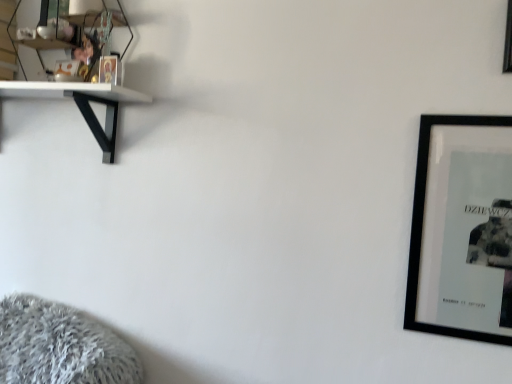
What is the approximate width of clear glass shelf at upper left?

It is 4.11 inches.

The image size is (512, 384). I want to click on clear glass shelf at upper left, so click(77, 31).

Considering the points (447, 205) and (503, 71), which point is behind, point (447, 205) or point (503, 71)?

The point (447, 205) is behind.

I want to click on picture frame located below the black matte picture frame at upper right, acting as the second picture frame starting from the bottom (from the image's perspective), so click(462, 229).

Is black matte picture frame at right, the second picture frame viewed from the top, positioned with its back to black matte picture frame at upper right, which is the 1th picture frame in top-to-bottom order?

No.

Is black matte picture frame at upper right, which is the 1th picture frame in top-to-bottom order, surrounding black matte picture frame at right, positioned as the first picture frame in bottom-to-top order?

No.

Is black matte picture frame at upper right, acting as the second picture frame starting from the bottom, not close to black matte picture frame at right, the second picture frame viewed from the top?

No, there isn't a large distance between black matte picture frame at upper right, acting as the second picture frame starting from the bottom, and black matte picture frame at right, the second picture frame viewed from the top.

From a real-world perspective, is black matte picture frame at upper right, acting as the second picture frame starting from the bottom, physically below black matte picture frame at right, the second picture frame viewed from the top?

No, from a real-world perspective, black matte picture frame at upper right, acting as the second picture frame starting from the bottom, is not beneath black matte picture frame at right, the second picture frame viewed from the top.

Looking at this image, can you confirm if black matte picture frame at right, the second picture frame viewed from the top, is smaller than clear glass shelf at upper left?

Yes.

Which is closer, [463,147] or [26,30]?

The point [463,147] is more forward.

Between black matte picture frame at right, the second picture frame viewed from the top, and clear glass shelf at upper left, which one has more height?

With more height is black matte picture frame at right, the second picture frame viewed from the top.

Locate an element on the screen. This screenshot has height=384, width=512. shelf behind the black matte picture frame at right, the second picture frame viewed from the top is located at coordinates (77, 31).

From a real-world perspective, between clear glass shelf at upper left and black matte picture frame at upper right, which is the 1th picture frame in top-to-bottom order, who is vertically higher?

In real-world perspective, clear glass shelf at upper left is above.

From the image's perspective, would you say clear glass shelf at upper left is shown under black matte picture frame at upper right, acting as the second picture frame starting from the bottom?

No, from the image's perspective, clear glass shelf at upper left is not below black matte picture frame at upper right, acting as the second picture frame starting from the bottom.

Looking at this image, is clear glass shelf at upper left not close to black matte picture frame at upper right, acting as the second picture frame starting from the bottom?

That's right, there is a large distance between clear glass shelf at upper left and black matte picture frame at upper right, acting as the second picture frame starting from the bottom.

Considering the points (62, 17) and (509, 21), which point is behind, point (62, 17) or point (509, 21)?

Point (62, 17)

Is black matte picture frame at upper right, which is the 1th picture frame in top-to-bottom order, further to the viewer compared to clear glass shelf at upper left?

That is False.

At what (x,y) coordinates should I click in order to perform the action: click on shelf lying behind the black matte picture frame at upper right, which is the 1th picture frame in top-to-bottom order. Please return your answer as a coordinate pair (x, y). Image resolution: width=512 pixels, height=384 pixels. Looking at the image, I should click on (x=77, y=31).

Is black matte picture frame at upper right, which is the 1th picture frame in top-to-bottom order, bigger than clear glass shelf at upper left?

Incorrect, black matte picture frame at upper right, which is the 1th picture frame in top-to-bottom order, is not larger than clear glass shelf at upper left.

Between black matte picture frame at upper right, acting as the second picture frame starting from the bottom, and clear glass shelf at upper left, which one appears on the left side from the viewer's perspective?

clear glass shelf at upper left is more to the left.

Considering the relative positions of clear glass shelf at upper left and black matte picture frame at right, the second picture frame viewed from the top, in the image provided, is clear glass shelf at upper left to the right of black matte picture frame at right, the second picture frame viewed from the top, from the viewer's perspective?

In fact, clear glass shelf at upper left is to the left of black matte picture frame at right, the second picture frame viewed from the top.

Is clear glass shelf at upper left inside or outside of black matte picture frame at right, positioned as the first picture frame in bottom-to-top order?

clear glass shelf at upper left is not enclosed by black matte picture frame at right, positioned as the first picture frame in bottom-to-top order.

From a real-world perspective, is clear glass shelf at upper left physically above black matte picture frame at right, the second picture frame viewed from the top?

Correct, in the physical world, clear glass shelf at upper left is higher than black matte picture frame at right, the second picture frame viewed from the top.

Is clear glass shelf at upper left positioned in front of black matte picture frame at right, positioned as the first picture frame in bottom-to-top order?

No, it is not.

Identify the location of picture frame that is above the black matte picture frame at right, the second picture frame viewed from the top (from the image's perspective). (508, 41).

The image size is (512, 384). There is a black matte picture frame at right, positioned as the first picture frame in bottom-to-top order. Find the location of `picture frame above it (from a real-world perspective)`. picture frame above it (from a real-world perspective) is located at coordinates (508, 41).

Which object lies further to the anchor point black matte picture frame at right, positioned as the first picture frame in bottom-to-top order, clear glass shelf at upper left or black matte picture frame at upper right, which is the 1th picture frame in top-to-bottom order?

Among the two, clear glass shelf at upper left is located further to black matte picture frame at right, positioned as the first picture frame in bottom-to-top order.

Estimate the real-world distances between objects in this image. Which object is further from clear glass shelf at upper left, black matte picture frame at upper right, which is the 1th picture frame in top-to-bottom order, or black matte picture frame at right, the second picture frame viewed from the top?

black matte picture frame at upper right, which is the 1th picture frame in top-to-bottom order, is further to clear glass shelf at upper left.

From the picture: Estimate the real-world distances between objects in this image. Which object is closer to clear glass shelf at upper left, black matte picture frame at right, positioned as the first picture frame in bottom-to-top order, or black matte picture frame at upper right, acting as the second picture frame starting from the bottom?

black matte picture frame at right, positioned as the first picture frame in bottom-to-top order, lies closer to clear glass shelf at upper left than the other object.

Considering their positions, is clear glass shelf at upper left positioned closer to black matte picture frame at upper right, acting as the second picture frame starting from the bottom, than black matte picture frame at right, the second picture frame viewed from the top?

Based on the image, black matte picture frame at right, the second picture frame viewed from the top, appears to be nearer to black matte picture frame at upper right, acting as the second picture frame starting from the bottom.

When comparing their distances from black matte picture frame at right, positioned as the first picture frame in bottom-to-top order, does black matte picture frame at upper right, acting as the second picture frame starting from the bottom, or clear glass shelf at upper left seem closer?

black matte picture frame at upper right, acting as the second picture frame starting from the bottom.

From the picture: Which object lies nearer to the anchor point black matte picture frame at upper right, which is the 1th picture frame in top-to-bottom order, black matte picture frame at right, positioned as the first picture frame in bottom-to-top order, or clear glass shelf at upper left?

The object closer to black matte picture frame at upper right, which is the 1th picture frame in top-to-bottom order, is black matte picture frame at right, positioned as the first picture frame in bottom-to-top order.

At what (x,y) coordinates should I click in order to perform the action: click on picture frame located between clear glass shelf at upper left and black matte picture frame at upper right, which is the 1th picture frame in top-to-bottom order, in the left-right direction. Please return your answer as a coordinate pair (x, y). Looking at the image, I should click on (462, 229).